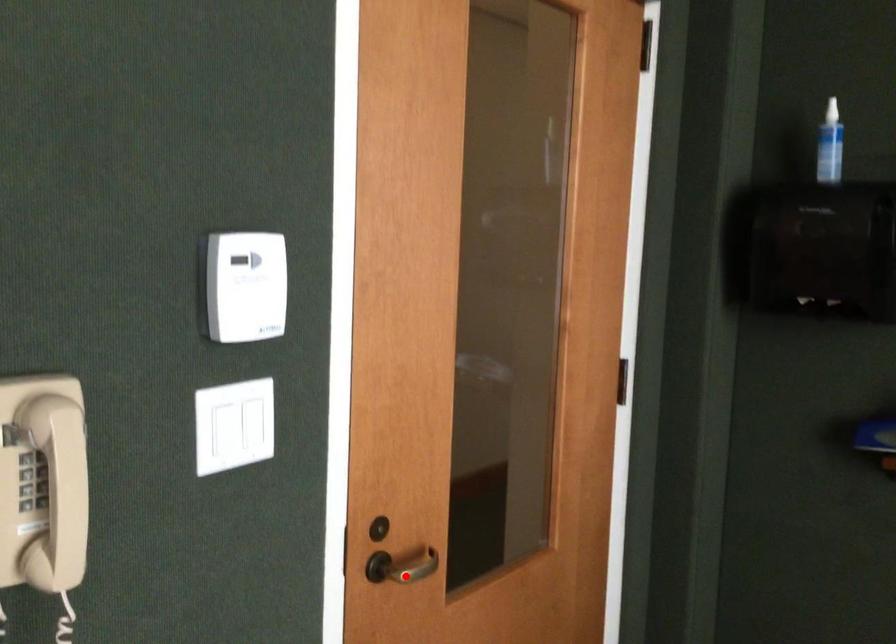
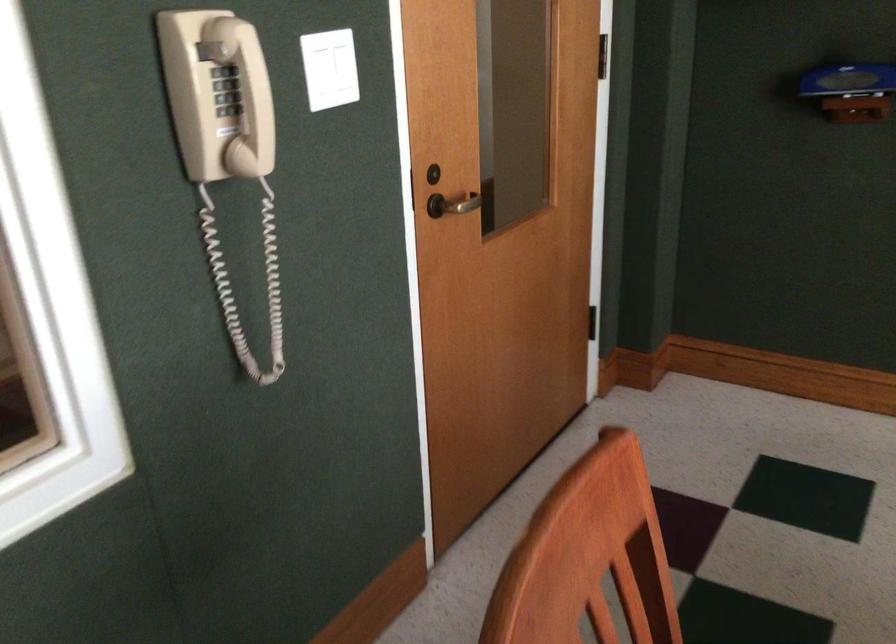
Question: I am providing you with two images of the same scene from different viewpoints. Image1 has a red point marked. In image2, the corresponding 3D location appears at what relative position? Reply with the corresponding letter.

Choices:
 (A) Closer
 (B) Farther

Answer: (B)